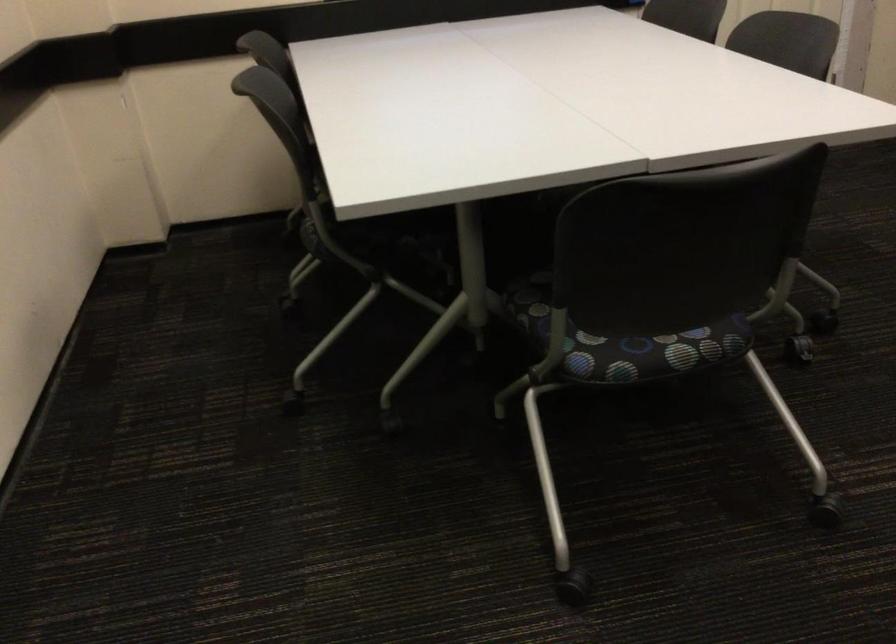
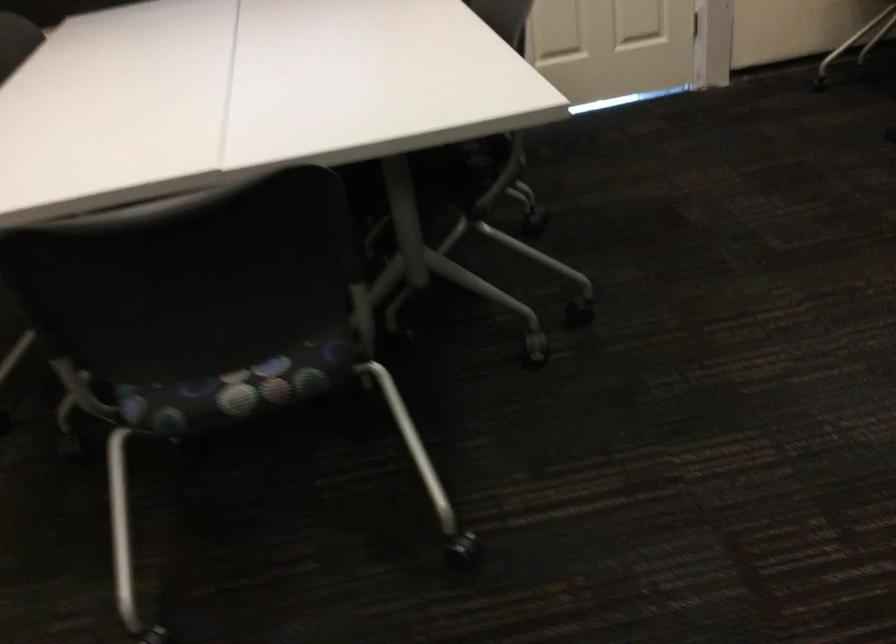
Question: The images are taken continuously from a first-person perspective. In which direction is your viewpoint rotating?

Choices:
 (A) Left
 (B) Right
 (C) Up
 (D) Down

Answer: (D)